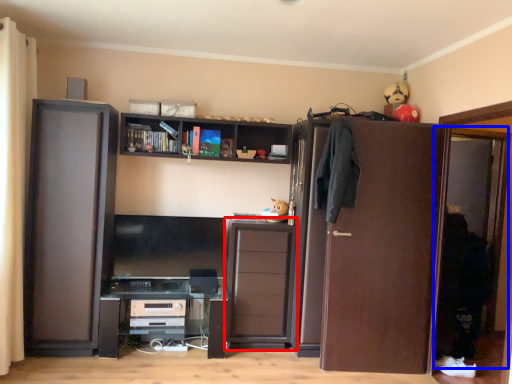
Question: Which object is further to the camera taking this photo, cabinetry (highlighted by a red box) or screen door (highlighted by a blue box)?

Choices:
 (A) cabinetry
 (B) screen door

Answer: (A)